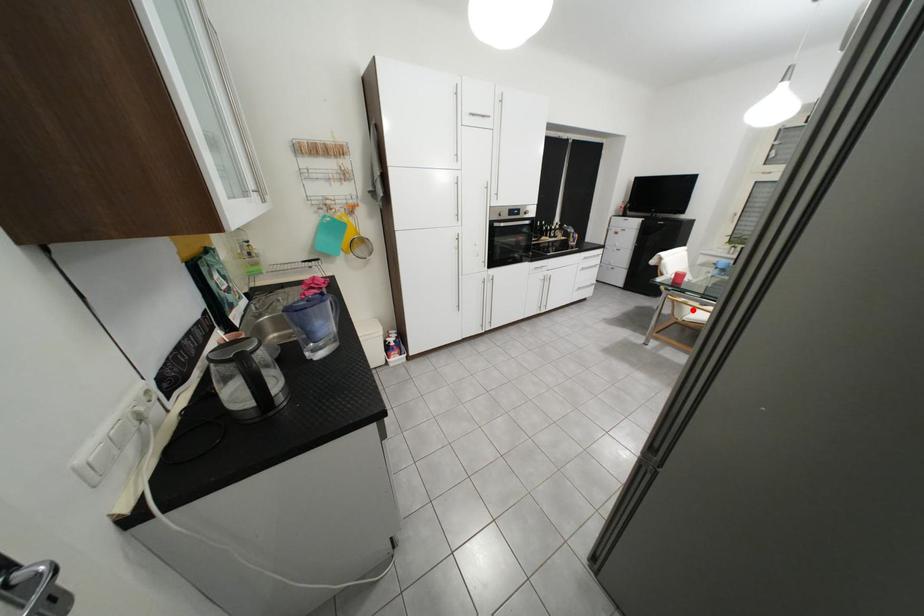
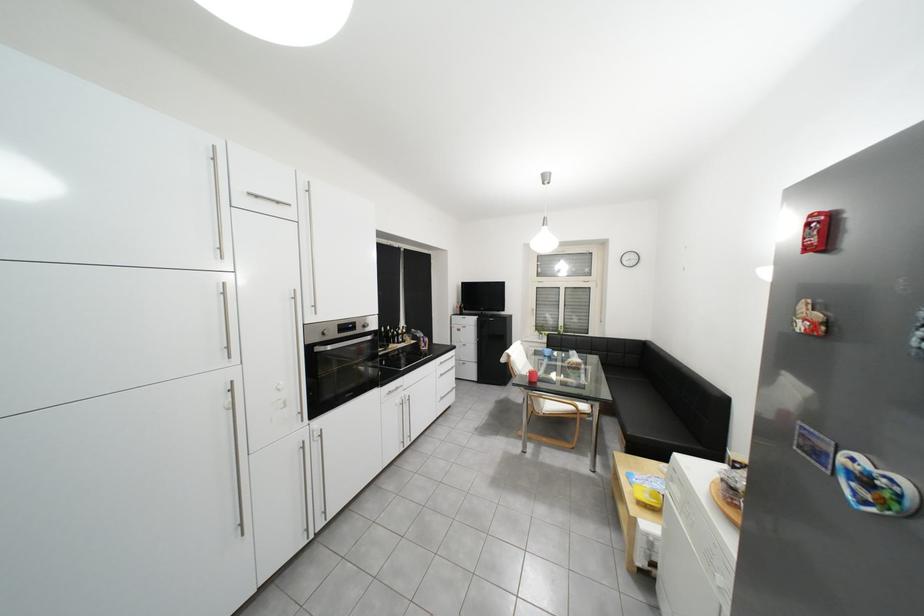
Question: I am providing you with two images of the same scene from different viewpoints. Given a red point in image1, look at the same physical point in image2. Is it:

Choices:
 (A) Closer to the viewpoint
 (B) Farther from the viewpoint

Answer: (B)